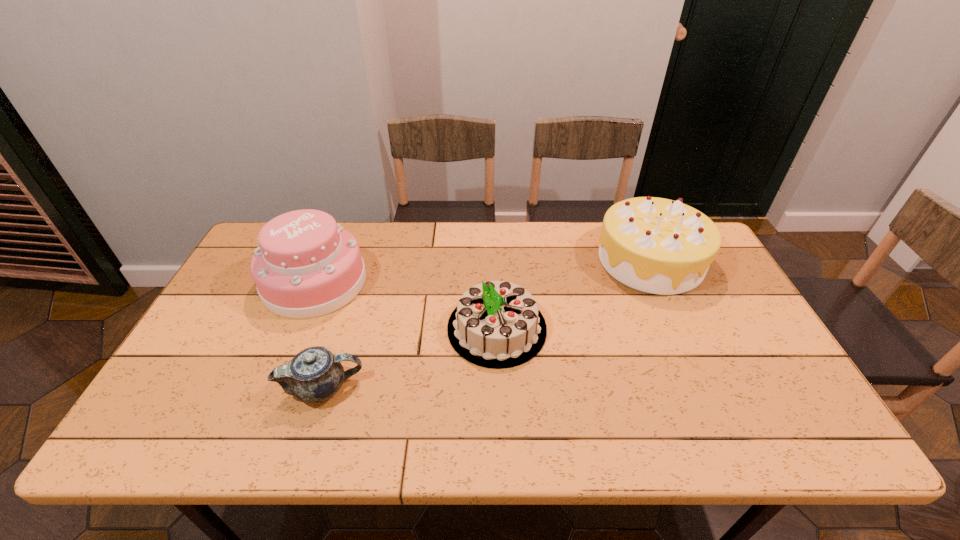
Where is `vacant area between the third object from left to right and the rightmost birthday cake`? This screenshot has height=540, width=960. vacant area between the third object from left to right and the rightmost birthday cake is located at coordinates (574, 294).

I want to click on free space between the rightmost birthday cake and the leftmost birthday cake, so click(483, 271).

Locate an element on the screen. Image resolution: width=960 pixels, height=540 pixels. free area in between the shortest object and the third object from left to right is located at coordinates (410, 358).

The image size is (960, 540). What are the coordinates of `vacant area between the chinaware and the second birthday cake from right to left` in the screenshot? It's located at (410, 358).

I want to click on free space between the leftmost birthday cake and the second object from right to left, so click(406, 305).

Locate an element on the screen. object identified as the second closest to the third object from left to right is located at coordinates (655, 245).

At what (x,y) coordinates should I click in order to perform the action: click on the second closest object relative to the second object from right to left. Please return your answer as a coordinate pair (x, y). This screenshot has width=960, height=540. Looking at the image, I should click on click(655, 245).

Locate an element on the screen. The image size is (960, 540). birthday cake that is the nearest to the rightmost object is located at coordinates (497, 324).

Find the location of a particular element. The image size is (960, 540). the closest birthday cake to the third object from left to right is located at coordinates (655, 245).

Find the location of `vacant space that satisfies the following two spatial constraints: 1. on the front side of the second birthday cake from right to left; 2. from the spout of the chinaware`. vacant space that satisfies the following two spatial constraints: 1. on the front side of the second birthday cake from right to left; 2. from the spout of the chinaware is located at coordinates (499, 388).